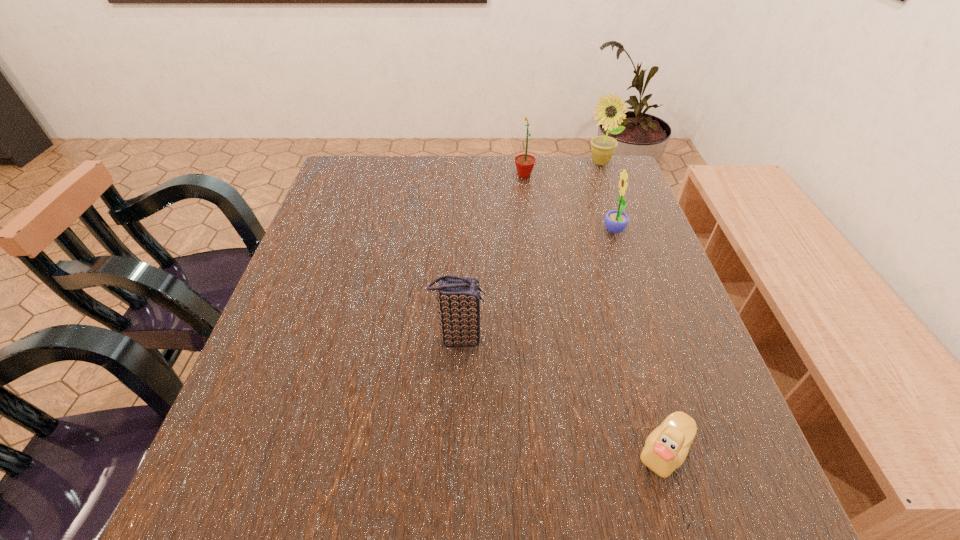
Find the location of `free location located 0.170m on the front-facing side of the third nearest object`. free location located 0.170m on the front-facing side of the third nearest object is located at coordinates (536, 231).

The width and height of the screenshot is (960, 540). What are the coordinates of `free space located on the front-facing side of the third nearest object` in the screenshot? It's located at (492, 231).

What are the coordinates of `free space located 0.210m with the zip open on the leftmost object` in the screenshot? It's located at (590, 338).

Locate an element on the screen. The image size is (960, 540). free space located at the beak of the shortest object is located at coordinates (426, 451).

This screenshot has width=960, height=540. In order to click on vacant space located at the beak of the shortest object in this screenshot , I will do `click(562, 451)`.

In order to click on vacant space located 0.350m at the beak of the shortest object in this screenshot , I will do `click(420, 451)`.

I want to click on object positioned at the near edge, so click(666, 448).

Where is `duck that is at the right edge`? The width and height of the screenshot is (960, 540). duck that is at the right edge is located at coordinates (666, 448).

What are the coordinates of `object that is positioned at the far right corner` in the screenshot? It's located at (603, 147).

You are a GUI agent. You are given a task and a screenshot of the screen. Output one action in this format:
    pyautogui.click(x=<x>, y=<y>)
    Task: Click on the object that is at the near right corner
    
    Given the screenshot: What is the action you would take?
    pyautogui.click(x=666, y=448)